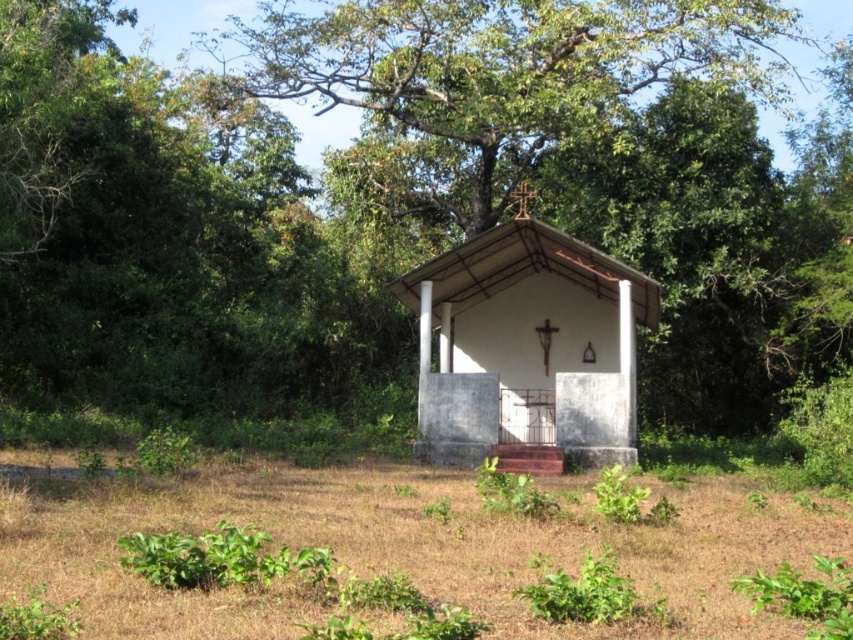
You are a gardener planning to mow the brown dry grass at center. Considering the space occupied by the white concrete hut at center, can you determine if the grass area is wider than the hut?

The brown dry grass at center might be wider than white concrete hut at center, so there is a possibility that the grass area is wider, but it is uncertain.

You are a gardener planning to trim the green leafy tree at center and the brown dry grass at center in the chapel area. Which object requires more effort due to its size?

The green leafy tree at center requires more effort to trim because it is larger in size than the brown dry grass at center.